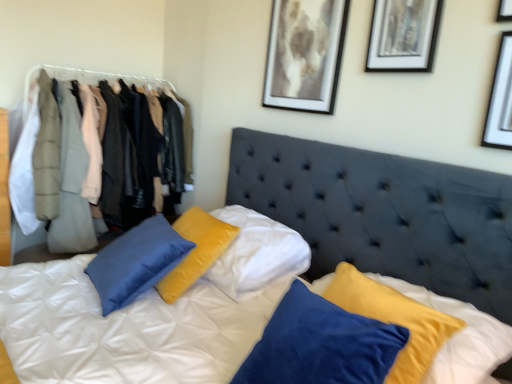
Question: Is suede-like dark blue headboard at center aimed at white matte picture frame at upper right, marked as the third picture frame in a back-to-front arrangement?

Choices:
 (A) yes
 (B) no

Answer: (B)

Question: Is suede-like dark blue headboard at center in front of white matte picture frame at upper right, which is counted as the 3th picture frame, starting from the left?

Choices:
 (A) no
 (B) yes

Answer: (B)

Question: Would you say white matte picture frame at upper right, which is counted as the 3th picture frame, starting from the left, is part of suede-like dark blue headboard at center's contents?

Choices:
 (A) no
 (B) yes

Answer: (A)

Question: Does suede-like dark blue headboard at center have a greater width compared to white matte picture frame at upper right, which is the 1th picture frame in front-to-back order?

Choices:
 (A) yes
 (B) no

Answer: (A)

Question: Does suede-like dark blue headboard at center have a larger size compared to white matte picture frame at upper right, the first picture frame viewed from the right?

Choices:
 (A) no
 (B) yes

Answer: (B)

Question: In the image, is matte gray coat at left, placed as the second clothing when sorted from front to back, positioned in front of or behind matte black picture frame at upper right, which appears as the 2th picture frame when viewed from the right?

Choices:
 (A) behind
 (B) front

Answer: (A)

Question: Looking at the image, does matte gray coat at left, placed as the second clothing when sorted from front to back, seem bigger or smaller compared to matte black picture frame at upper right, which appears as the 2th picture frame when viewed from the right?

Choices:
 (A) big
 (B) small

Answer: (A)

Question: In terms of height, does matte gray coat at left, placed as the second clothing when sorted from front to back, look taller or shorter compared to matte black picture frame at upper right, which appears as the 2th picture frame when viewed from the right?

Choices:
 (A) tall
 (B) short

Answer: (A)

Question: Is matte gray coat at left, which ranks as the first clothing in back-to-front order, situated inside matte black picture frame at upper right, which appears as the 2th picture frame when viewed from the right, or outside?

Choices:
 (A) inside
 (B) outside

Answer: (B)

Question: From the image's perspective, is matte black picture frame at upper right, arranged as the 2th picture frame when viewed from the front, positioned above or below matte gray coat at left, placed as the second clothing when sorted from front to back?

Choices:
 (A) above
 (B) below

Answer: (A)

Question: Is matte black picture frame at upper right, which appears as the 2th picture frame when viewed from the right, bigger or smaller than matte gray coat at left, placed as the second clothing when sorted from front to back?

Choices:
 (A) big
 (B) small

Answer: (B)

Question: Is matte black picture frame at upper right, the 2th picture frame positioned from the back, to the left or to the right of matte gray coat at left, which ranks as the first clothing in back-to-front order, in the image?

Choices:
 (A) left
 (B) right

Answer: (B)

Question: Is point (387, 44) closer or farther from the camera than point (67, 205)?

Choices:
 (A) farther
 (B) closer

Answer: (B)

Question: In the image, is velvet jackets at left on the left side or the right side of white matte picture frame at upper right, which is the 1th picture frame in front-to-back order?

Choices:
 (A) right
 (B) left

Answer: (B)

Question: From a real-world perspective, is velvet jackets at left above or below white matte picture frame at upper right, the first picture frame viewed from the right?

Choices:
 (A) below
 (B) above

Answer: (A)